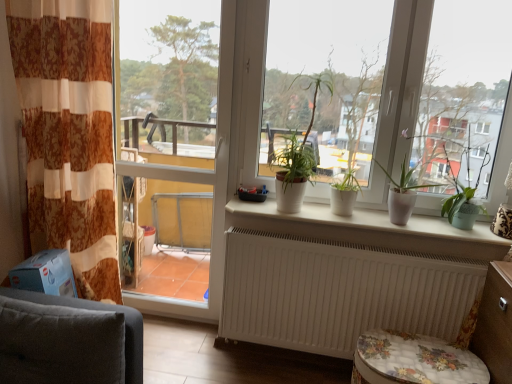
Where is `free point in front of transparent glass screen door at left`? This screenshot has width=512, height=384. free point in front of transparent glass screen door at left is located at coordinates (170, 347).